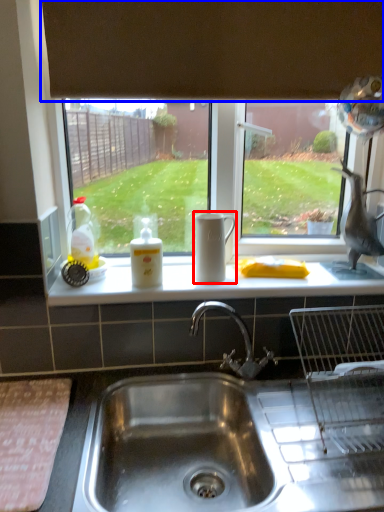
Question: Among these objects, which one is nearest to the camera, jug (highlighted by a red box) or exhaust hood (highlighted by a blue box)?

Choices:
 (A) jug
 (B) exhaust hood

Answer: (B)